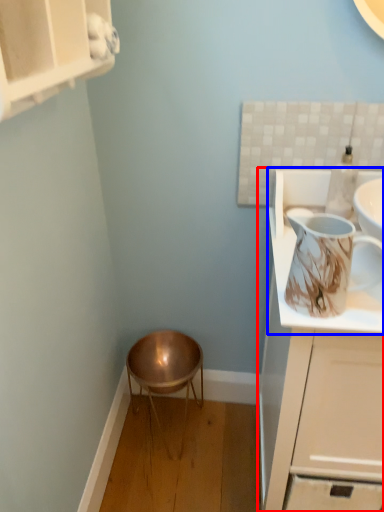
Question: Which object is further to the camera taking this photo, cabinetry (highlighted by a red box) or countertop (highlighted by a blue box)?

Choices:
 (A) cabinetry
 (B) countertop

Answer: (B)